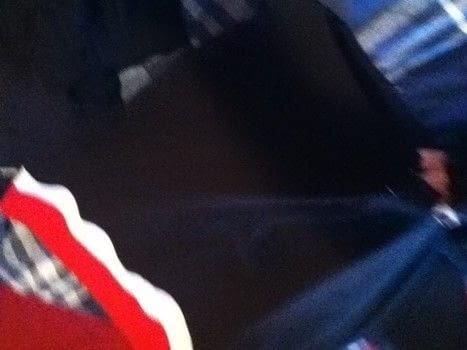
At what (x,y) coordinates should I click in order to perform the action: click on plaid fabric. Please return your answer as a coordinate pair (x, y). Image resolution: width=467 pixels, height=350 pixels. Looking at the image, I should click on (214, 20), (418, 49), (40, 279).